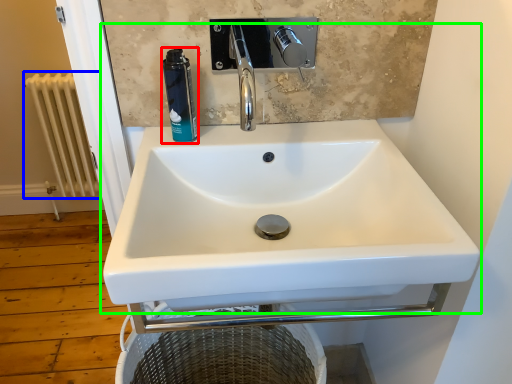
Question: Considering the real-world distances, which object is closest to mouthwash (highlighted by a red box)? radiator (highlighted by a blue box) or sink (highlighted by a green box).

Choices:
 (A) radiator
 (B) sink

Answer: (B)